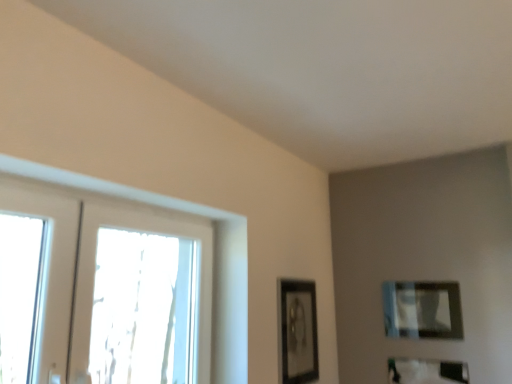
Question: Can you confirm if clear glass window at left is positioned to the right of matte black picture frame at upper right, which is counted as the 2th picture frame, starting from the left?

Choices:
 (A) no
 (B) yes

Answer: (A)

Question: Is clear glass window at left to the left of matte black picture frame at upper right, which is counted as the 2th picture frame, starting from the left, from the viewer's perspective?

Choices:
 (A) yes
 (B) no

Answer: (A)

Question: Is clear glass window at left smaller than matte black picture frame at upper right, which is counted as the 2th picture frame, starting from the left?

Choices:
 (A) no
 (B) yes

Answer: (A)

Question: Does clear glass window at left have a greater height compared to matte black picture frame at upper right, which is counted as the 2th picture frame, starting from the right?

Choices:
 (A) no
 (B) yes

Answer: (B)

Question: Would you say clear glass window at left is outside matte black picture frame at upper right, which is counted as the 2th picture frame, starting from the left?

Choices:
 (A) no
 (B) yes

Answer: (B)

Question: Looking at their shapes, would you say matte black picture frame at upper right, which is counted as the 2th picture frame, starting from the left, is wider or thinner than clear glass window at left?

Choices:
 (A) wide
 (B) thin

Answer: (B)

Question: Do you think matte black picture frame at upper right, which is counted as the 2th picture frame, starting from the right, is within clear glass window at left, or outside of it?

Choices:
 (A) outside
 (B) inside

Answer: (A)

Question: From a real-world perspective, is matte black picture frame at upper right, which is counted as the 2th picture frame, starting from the right, physically located above or below clear glass window at left?

Choices:
 (A) below
 (B) above

Answer: (A)

Question: From their relative heights in the image, would you say matte black picture frame at upper right, which is counted as the 2th picture frame, starting from the left, is taller or shorter than clear glass window at left?

Choices:
 (A) tall
 (B) short

Answer: (B)

Question: Do you think matte black picture frame at center, marked as the first picture frame in a left-to-right arrangement, is within clear glass window at left, or outside of it?

Choices:
 (A) outside
 (B) inside

Answer: (A)

Question: Is point (294, 292) positioned closer to the camera than point (160, 302)?

Choices:
 (A) closer
 (B) farther

Answer: (A)

Question: Is matte black picture frame at center, marked as the first picture frame in a left-to-right arrangement, bigger or smaller than clear glass window at left?

Choices:
 (A) small
 (B) big

Answer: (A)

Question: In the image, is matte black picture frame at center, marked as the first picture frame in a left-to-right arrangement, positioned in front of or behind clear glass window at left?

Choices:
 (A) front
 (B) behind

Answer: (B)

Question: In terms of width, does clear glass window at left look wider or thinner when compared to matte black picture frame at center, marked as the first picture frame in a left-to-right arrangement?

Choices:
 (A) thin
 (B) wide

Answer: (B)

Question: Is clear glass window at left to the left or to the right of matte black picture frame at center, acting as the 3th picture frame starting from the right, in the image?

Choices:
 (A) right
 (B) left

Answer: (B)